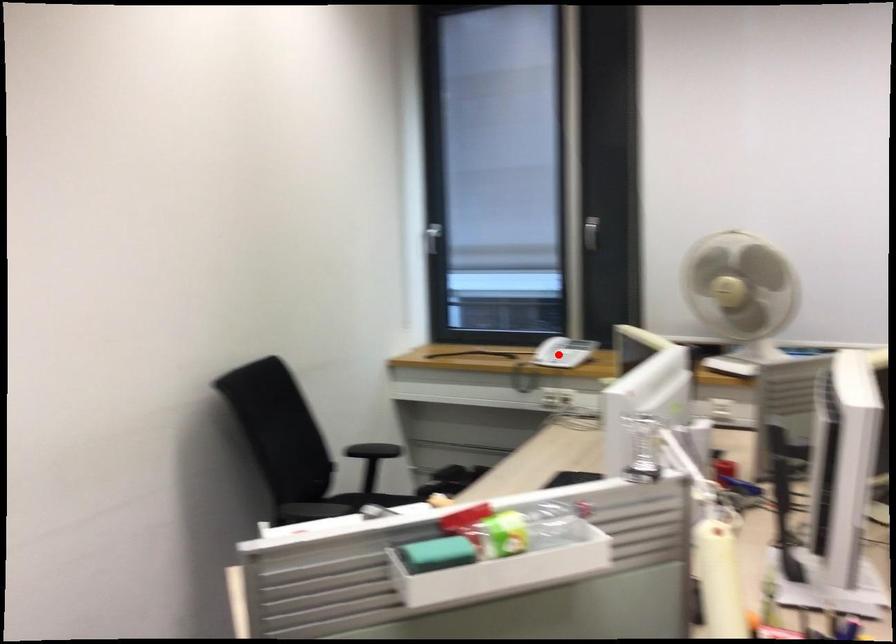
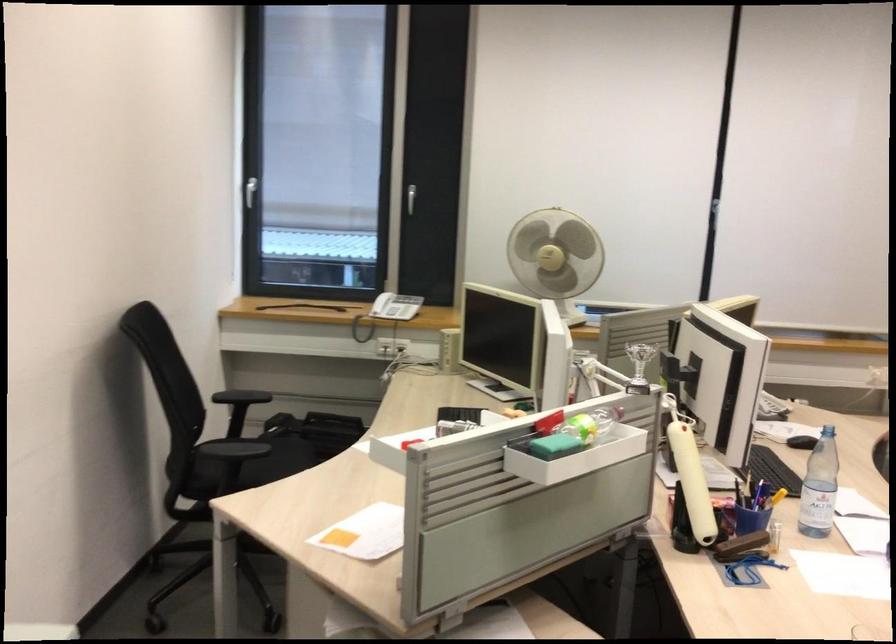
In the second image, find the point that corresponds to the highlighted location in the first image.

(386, 312)